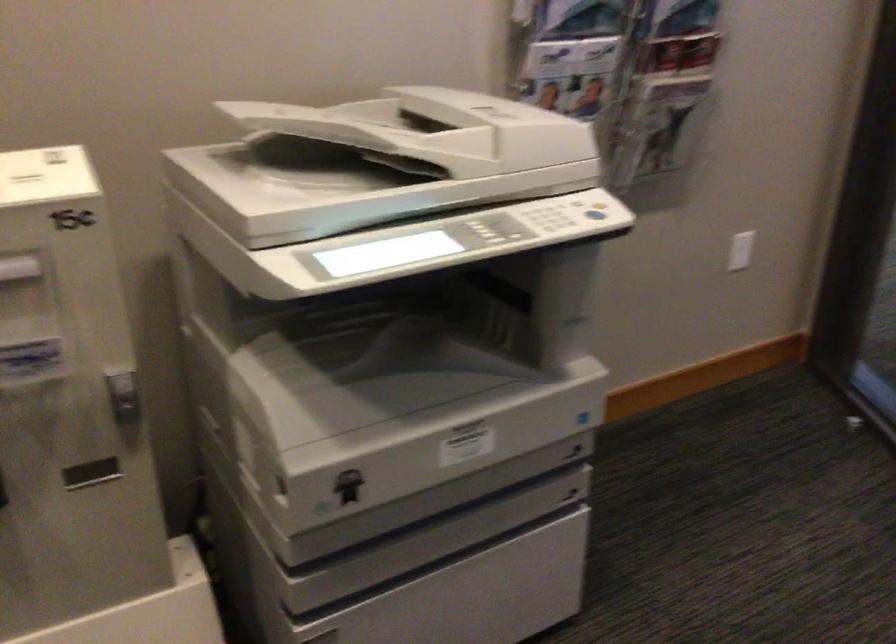
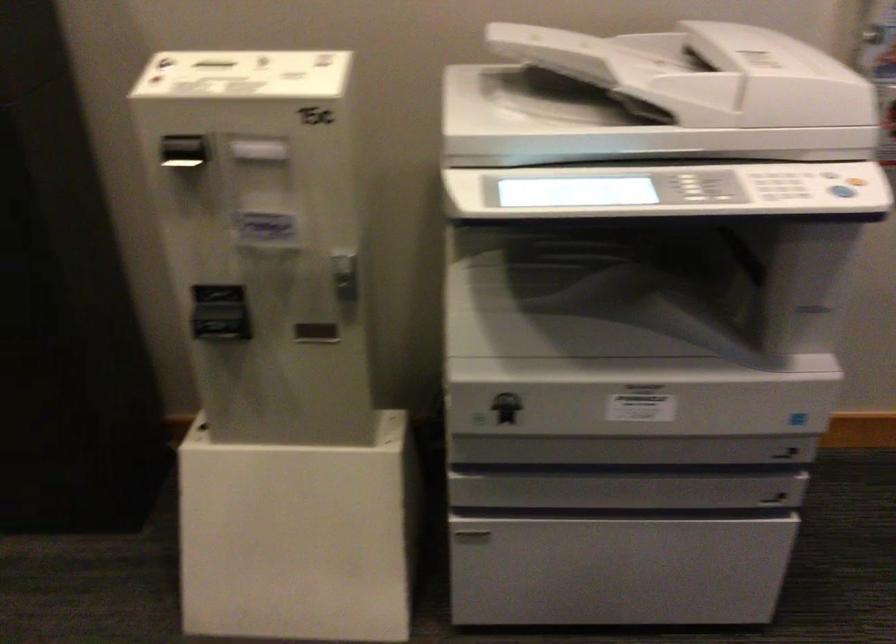
In the second image, find the point that corresponds to (462,129) in the first image.

(702, 73)